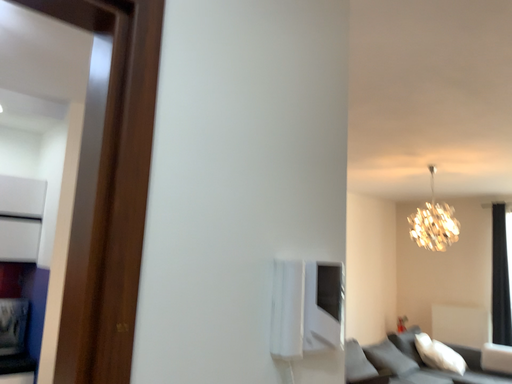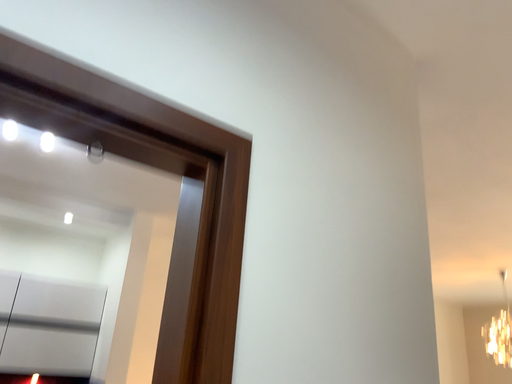
Question: Which way did the camera rotate in the video?

Choices:
 (A) rotated left
 (B) rotated right

Answer: (A)